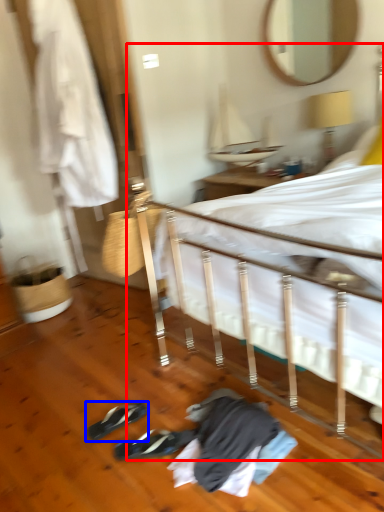
Question: Which object appears farthest to the camera in this image, bed (highlighted by a red box) or footwear (highlighted by a blue box)?

Choices:
 (A) bed
 (B) footwear

Answer: (B)